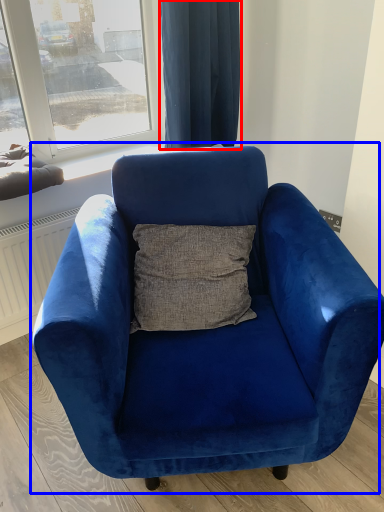
Question: Which point is further to the camera, curtain (highlighted by a red box) or chair (highlighted by a blue box)?

Choices:
 (A) curtain
 (B) chair

Answer: (A)